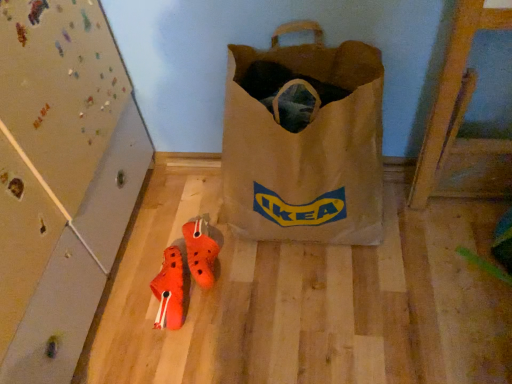
You are a GUI agent. You are given a task and a screenshot of the screen. Output one action in this format:
    pyautogui.click(x=<x>, y=<y>)
    Task: Click on the vacant space to the right of brown paper bag at center
    The height and width of the screenshot is (384, 512).
    Given the screenshot: What is the action you would take?
    pyautogui.click(x=431, y=237)